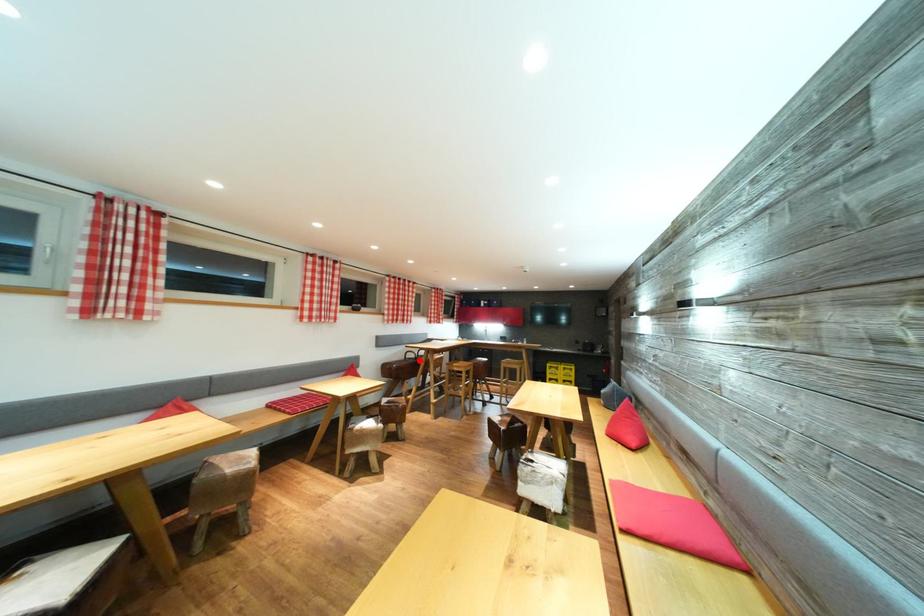
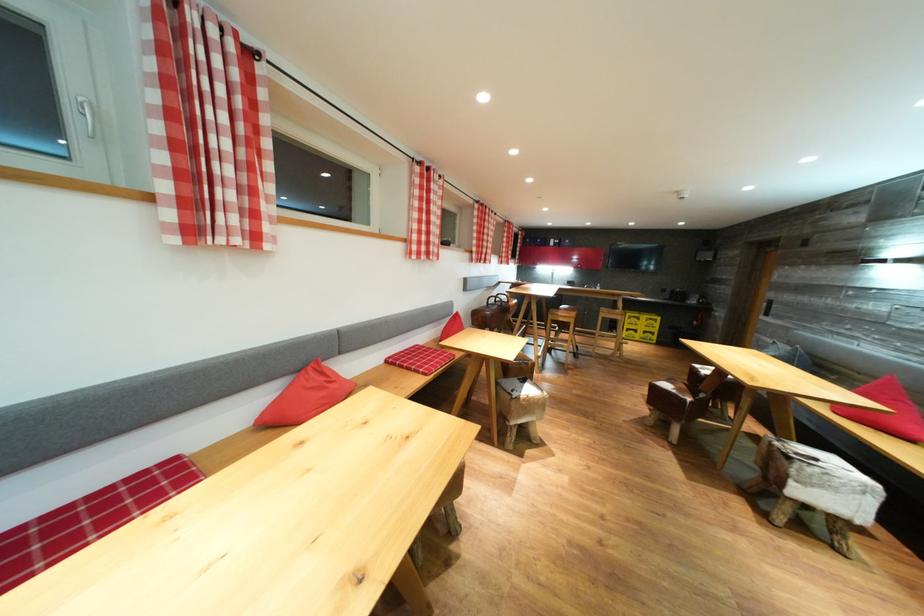
Question: I am providing you with two images of the same scene from different viewpoints. Given a red point in image1, look at the same physical point in image2. Is it:

Choices:
 (A) Closer to the viewpoint
 (B) Farther from the viewpoint

Answer: (A)